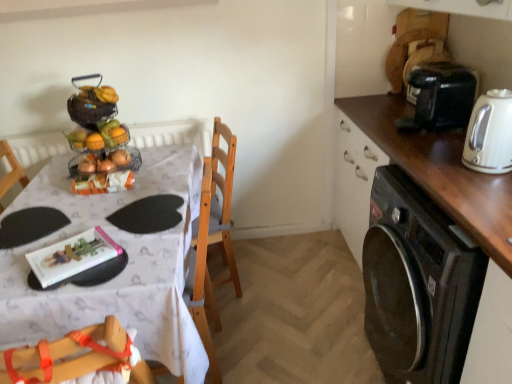
Find the location of a particular element. The image size is (512, 384). free space behind black matte paper plate at lower left is located at coordinates (46, 194).